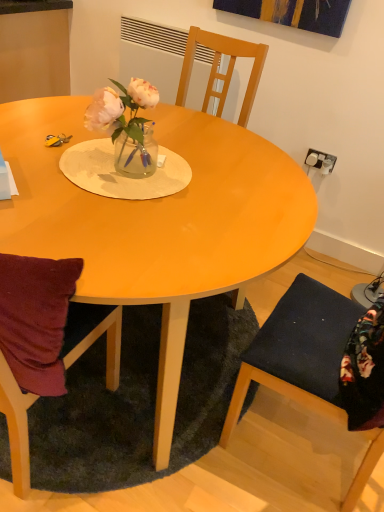
The width and height of the screenshot is (384, 512). Identify the location of free space above matte wood table at center (from a real-world perspective). (157, 157).